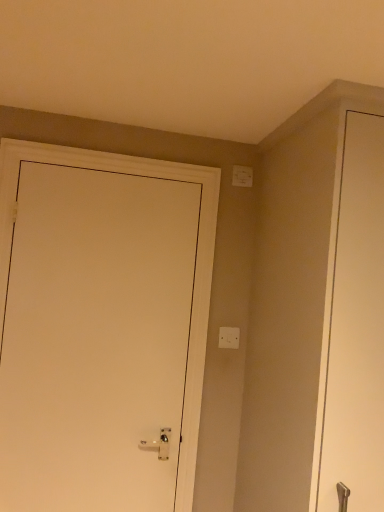
Question: Is white plastic light switch at upper right, arranged as the first light switch when viewed from the top, situated inside white matte door at left or outside?

Choices:
 (A) inside
 (B) outside

Answer: (B)

Question: Is white plastic light switch at upper right, positioned as the second light switch in bottom-to-top order, in front of or behind white matte door at left in the image?

Choices:
 (A) behind
 (B) front

Answer: (A)

Question: Which is farther from the white plastic light switch at upper right, arranged as the first light switch when viewed from the top?

Choices:
 (A) white matte door at left
 (B) white plastic light switch at center, marked as the first light switch in a bottom-to-top arrangement

Answer: (A)

Question: Which object is positioned closest to the white plastic light switch at center, marked as the first light switch in a bottom-to-top arrangement?

Choices:
 (A) white plastic light switch at upper right, positioned as the second light switch in bottom-to-top order
 (B) white matte door at left

Answer: (B)